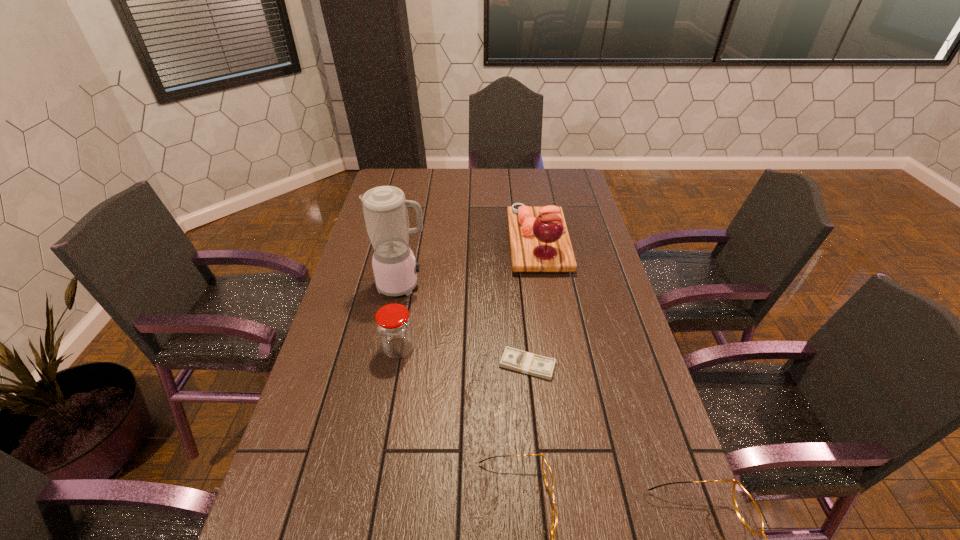
The width and height of the screenshot is (960, 540). I want to click on vacant space at the far edge, so click(x=449, y=179).

Image resolution: width=960 pixels, height=540 pixels. What are the coordinates of `blank space at the near edge of the desktop` in the screenshot? It's located at click(568, 537).

At what (x,y) coordinates should I click in order to perform the action: click on free spot at the left edge of the desktop. Please return your answer as a coordinate pair (x, y). The image size is (960, 540). Looking at the image, I should click on (300, 416).

Identify the location of free space at the right edge of the desktop. (608, 273).

The width and height of the screenshot is (960, 540). In order to click on vacant region at the near right corner of the desktop in this screenshot , I will do `click(636, 526)`.

You are a GUI agent. You are given a task and a screenshot of the screen. Output one action in this format:
    pyautogui.click(x=<x>, y=<y>)
    Task: Click on the free spot between the tallest object and the shortest object
    The height and width of the screenshot is (540, 960).
    Given the screenshot: What is the action you would take?
    pyautogui.click(x=466, y=325)

Identify the location of free space between the tallest object and the dollar. (466, 325).

The image size is (960, 540). I want to click on free space that is in between the shortest object and the platter, so click(533, 304).

Locate which object ranks fifth in proximity to the shorter spectacles. Please provide its 2D coordinates. Your answer should be formatted as a tuple, i.e. [(x, y)], where the tuple contains the x and y coordinates of a point satisfying the conditions above.

[(539, 241)]

Identify the location of the second closest object relative to the dollar. (393, 324).